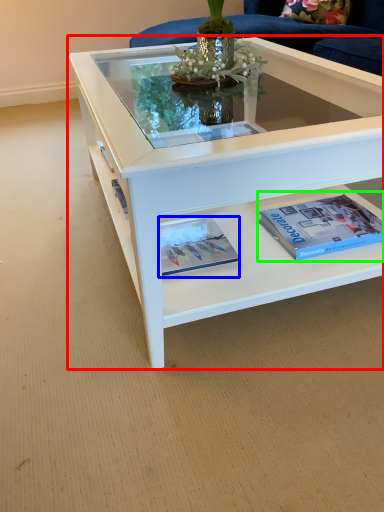
Question: Which object is the closest to the coffee table (highlighted by a red box)? Choose among these: magazine (highlighted by a blue box) or paperback book (highlighted by a green box).

Choices:
 (A) magazine
 (B) paperback book

Answer: (B)